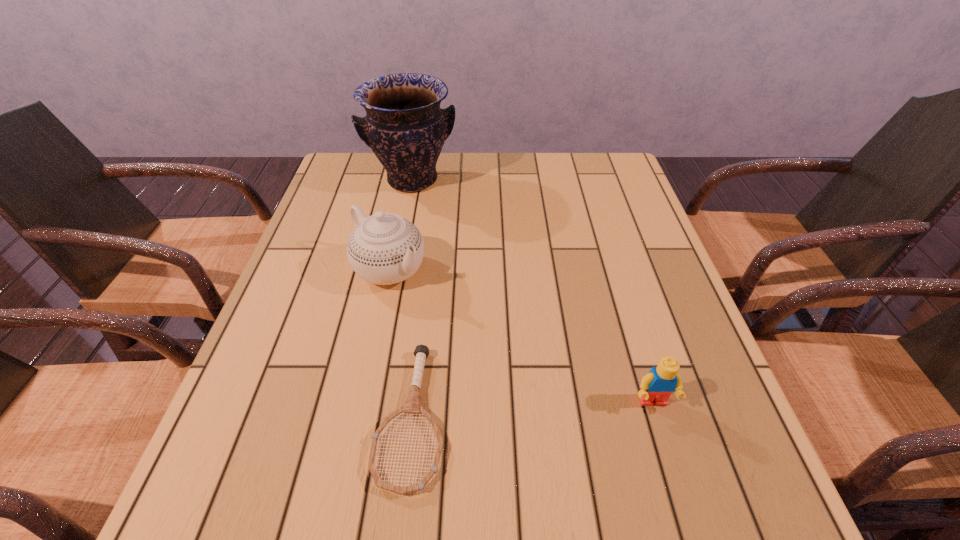
Image resolution: width=960 pixels, height=540 pixels. I want to click on vacant point located on the front handle of the tallest object, so click(x=439, y=239).

The image size is (960, 540). I want to click on vacant space located 0.260m on the spout of the third shortest object, so click(x=493, y=354).

Locate an element on the screen. The width and height of the screenshot is (960, 540). vacant space located on the spout of the third shortest object is located at coordinates (540, 390).

What are the coordinates of `vacant space located 0.330m on the spout of the third shortest object` in the screenshot? It's located at (519, 374).

Image resolution: width=960 pixels, height=540 pixels. I want to click on object that is at the far edge, so click(x=405, y=127).

In order to click on tennis racket that is positioned at the near edge in this screenshot , I will do click(x=413, y=406).

The width and height of the screenshot is (960, 540). In order to click on Lego that is at the near edge in this screenshot , I will do click(x=656, y=387).

The height and width of the screenshot is (540, 960). Find the location of `pottery that is at the left edge`. pottery that is at the left edge is located at coordinates (405, 127).

I want to click on chinaware that is at the left edge, so click(x=384, y=248).

The height and width of the screenshot is (540, 960). Identify the location of object that is at the right edge. (656, 387).